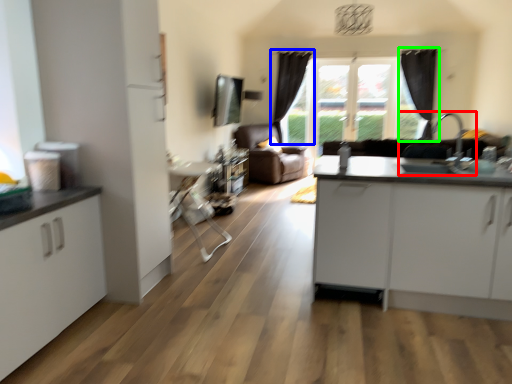
Question: Based on their relative distances, which object is farther from sink (highlighted by a red box)? Choose from curtain (highlighted by a blue box) and curtain (highlighted by a green box).

Choices:
 (A) curtain
 (B) curtain

Answer: (A)